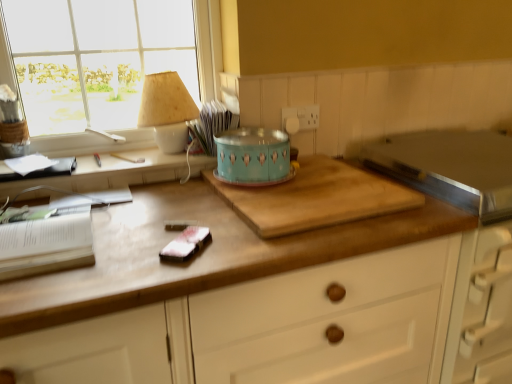
This screenshot has width=512, height=384. In order to click on vacant area located to the right-hand side of white paper book at left in this screenshot , I will do `click(153, 226)`.